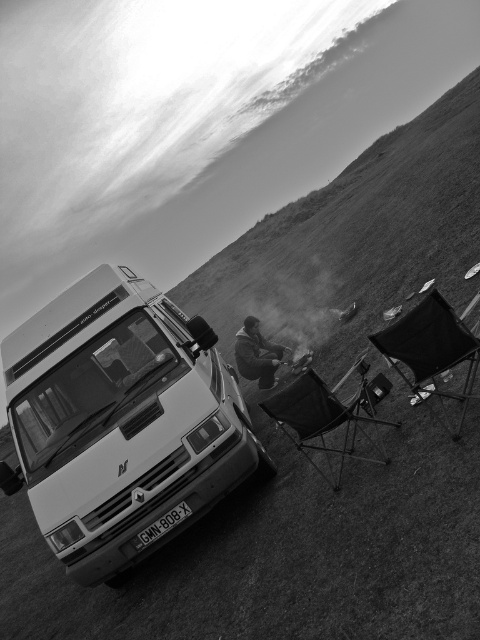
You are a hiker who just arrived at the campsite. You see the black fabric folding chair at right and the black plastic license plate at center. Which object is positioned further to the right?

The black fabric folding chair at right is positioned further to the right than the black plastic license plate at center.

You are a photographer analyzing the camping scene. You notice the black fabric folding chair at right and the black plastic license plate at center. Which object is significantly taller?

The black fabric folding chair at right is much taller than the black plastic license plate at center.